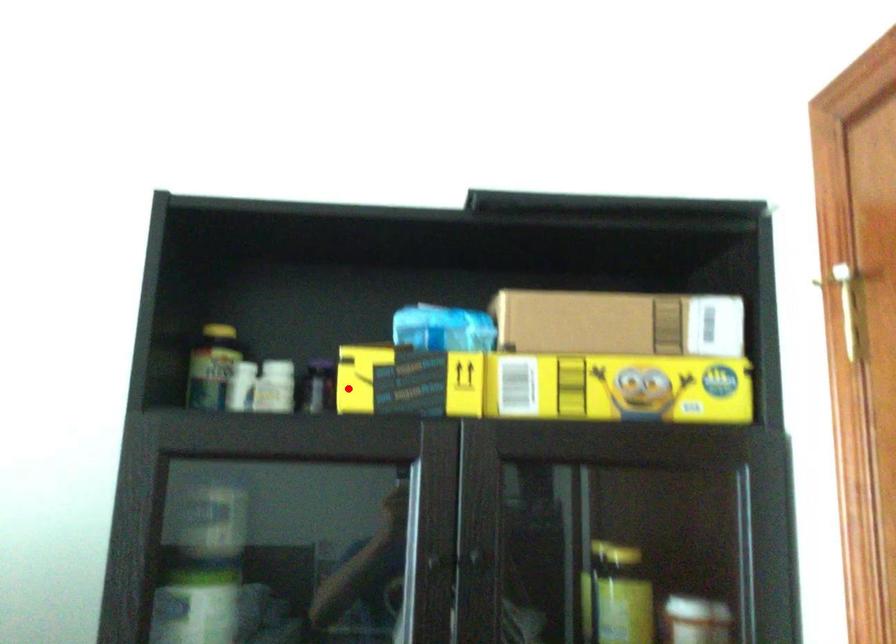
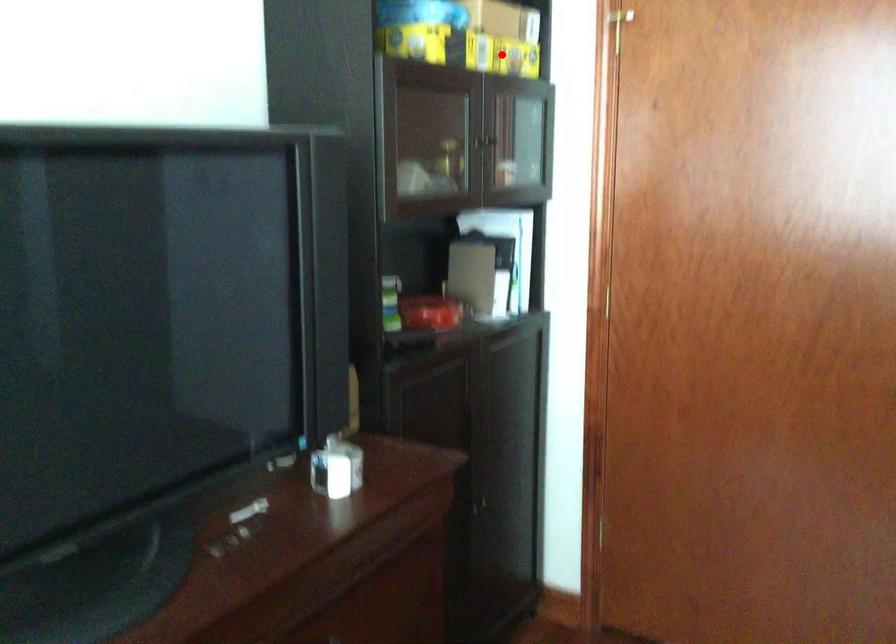
I am providing you with two images of the same scene from different viewpoints. A red point is marked on the first image and another point is marked on the second image. Is the marked point in image1 the same physical position as the marked point in image2?

No